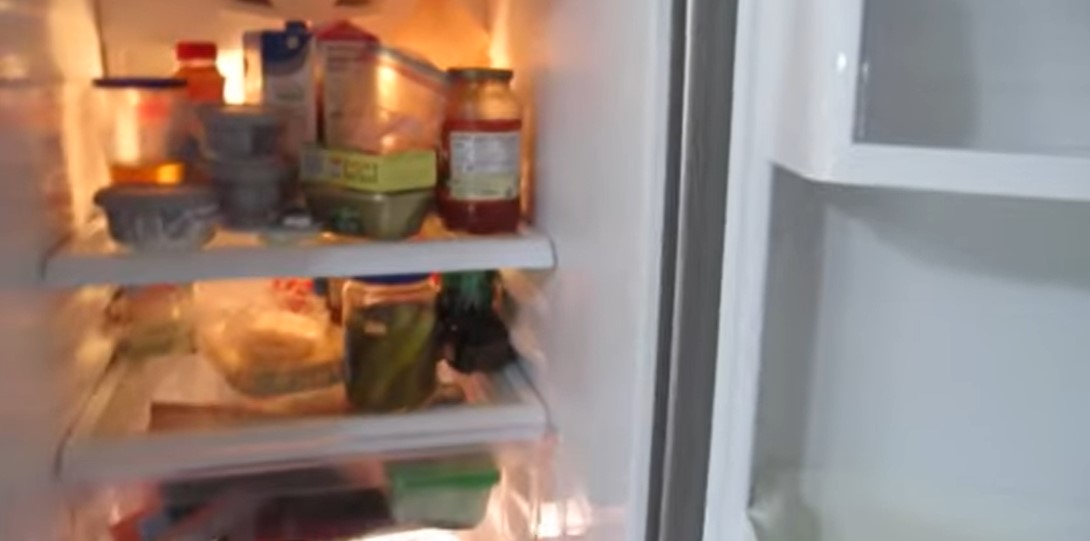
This screenshot has width=1090, height=541. What are the coordinates of `fridge drawer` in the screenshot? It's located at (458, 536).